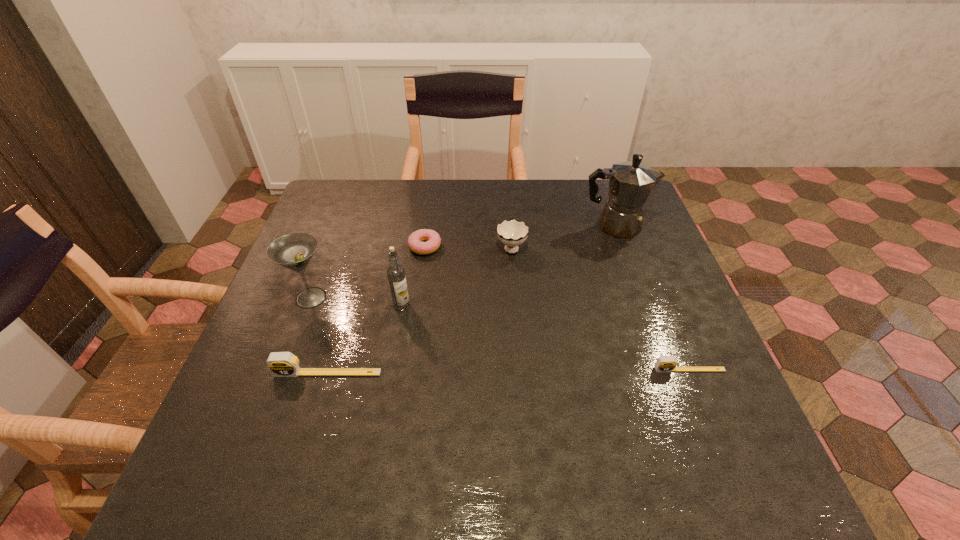
This screenshot has height=540, width=960. What are the coordinates of `vacant spot for a new tape_measure to ensure equal spacing` in the screenshot? It's located at (509, 371).